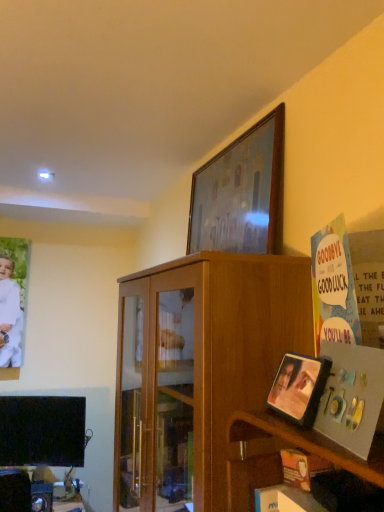
Question: Is white paper at right in front of or behind wooden shelf at lower right in the image?

Choices:
 (A) front
 (B) behind

Answer: (A)

Question: From a real-world perspective, is white paper at right physically located above or below wooden shelf at lower right?

Choices:
 (A) below
 (B) above

Answer: (B)

Question: Considering the real-world distances, which object is farthest from the wooden photo frame at lower right, placed as the second picture frame when sorted from top to bottom?

Choices:
 (A) white paper at right
 (B) wooden cabinet at upper center
 (C) wooden picture frame at upper center, which appears as the 1th picture frame when viewed from the back
 (D) white matte clothing at left
 (E) wooden shelf at lower right

Answer: (D)

Question: Which of these objects is positioned farthest from the wooden picture frame at upper center, the 1th picture frame positioned from the top?

Choices:
 (A) wooden cabinet at upper center
 (B) white paper at right
 (C) white matte clothing at left
 (D) wooden photo frame at lower right, which is the 2th picture frame in back-to-front order
 (E) wooden shelf at lower right

Answer: (C)